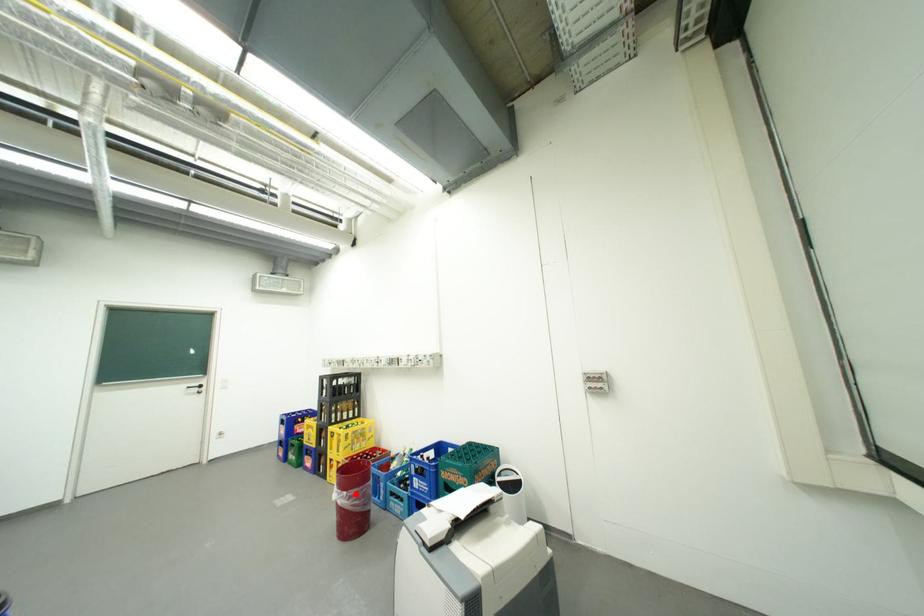
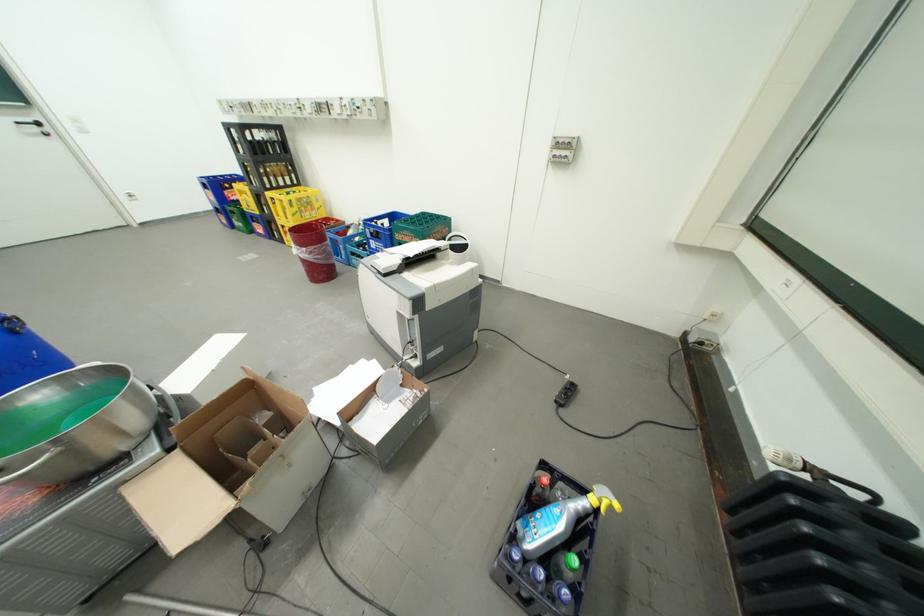
Question: I am providing you with two images of the same scene from different viewpoints. A red point is shown in image1. For the corresponding object point in image2, is it positioned nearer or farther from the camera?

Choices:
 (A) Nearer
 (B) Farther

Answer: (A)